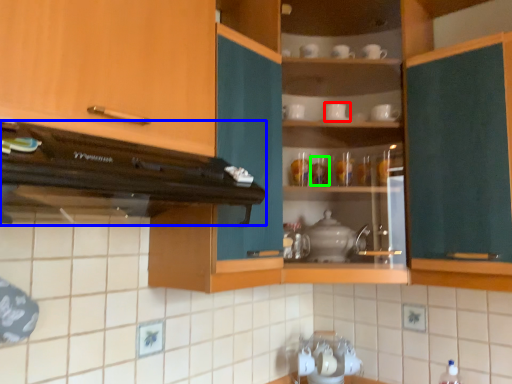
Question: Which is farther away from tableware (highlighted by a red box)? home appliance (highlighted by a blue box) or tableware (highlighted by a green box)?

Choices:
 (A) home appliance
 (B) tableware

Answer: (A)